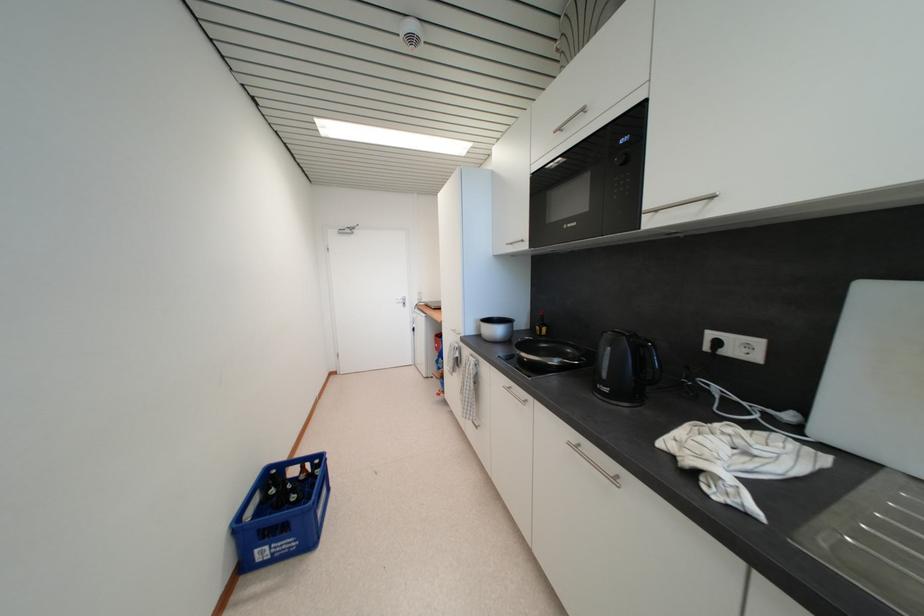
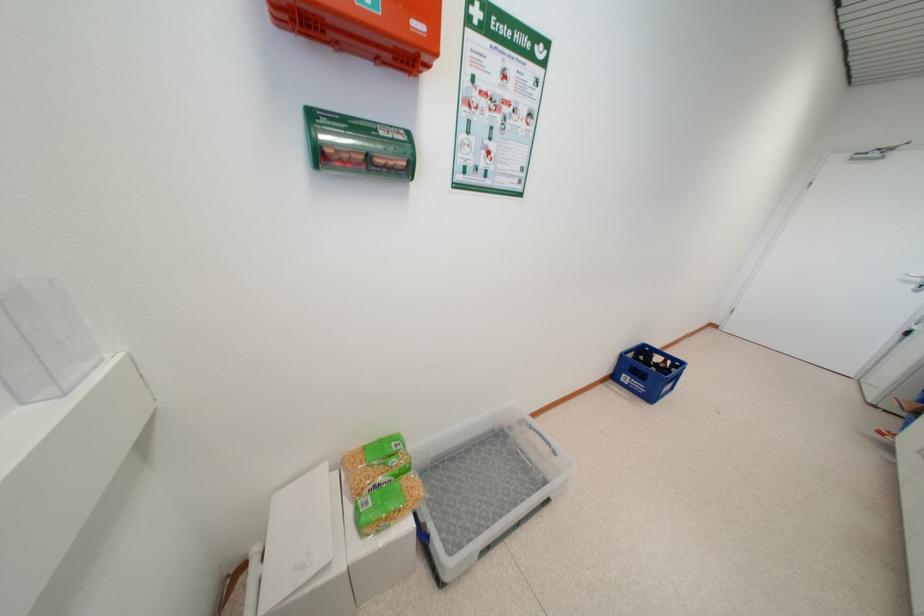
Where in the second image is the point corresponding to (x=405, y=305) from the first image?

(912, 284)